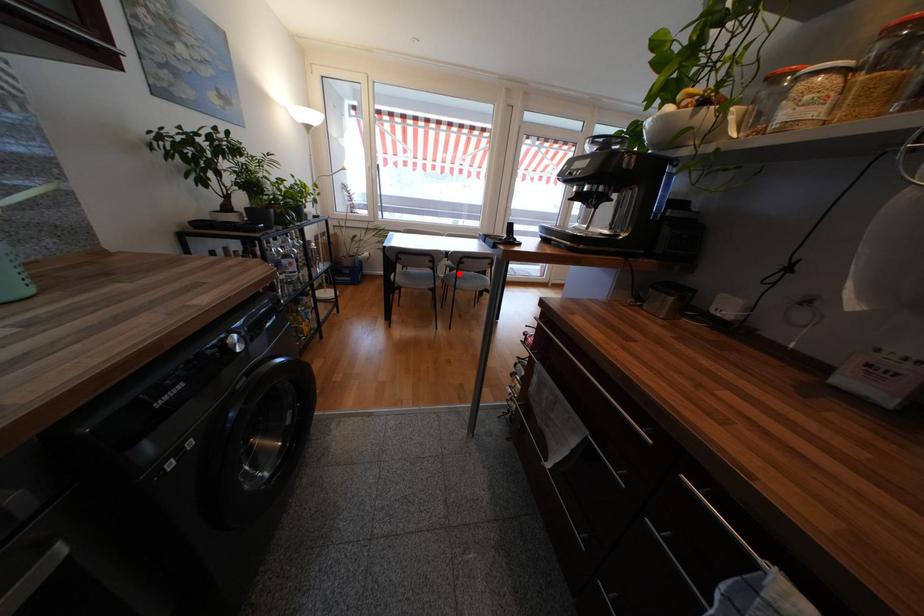
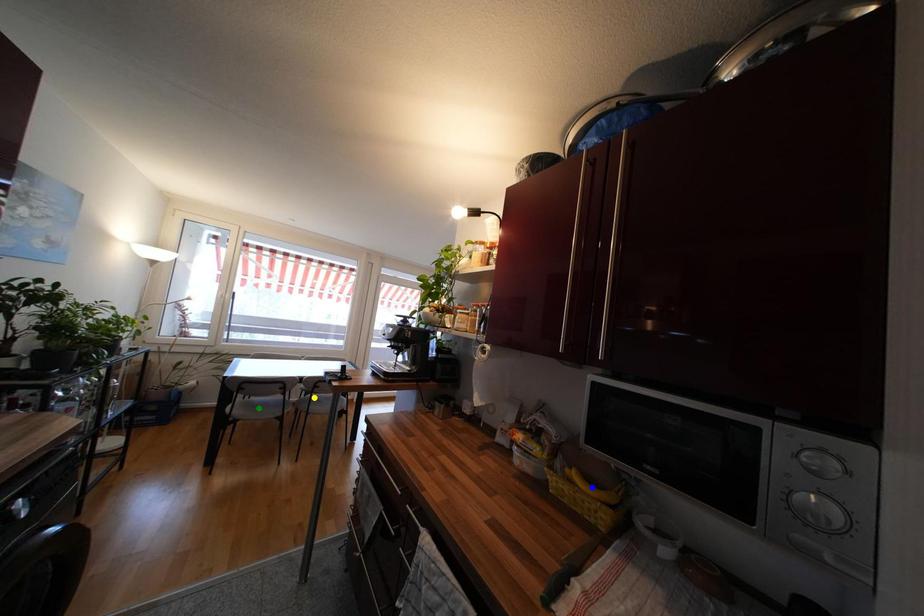
Question: I am providing you with two images of the same scene from different viewpoints. A red point is marked on the first image. You are given multiple points on the second image. In image 2, which mark is for the same physical point as the one in image 1?

Choices:
 (A) green point
 (B) yellow point
 (C) blue point

Answer: (B)